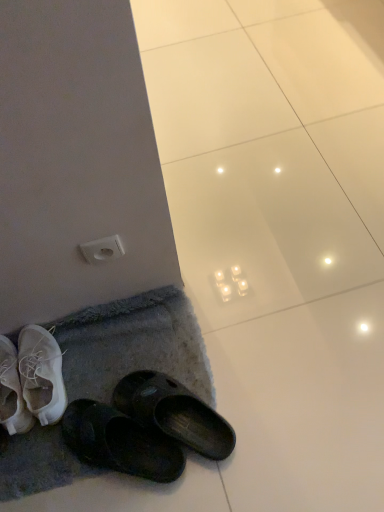
What is the approximate height of gray textured bath mat at lower left?

gray textured bath mat at lower left is 4.61 centimeters tall.

The width and height of the screenshot is (384, 512). In order to click on gray textured bath mat at lower left in this screenshot , I will do `click(134, 345)`.

Image resolution: width=384 pixels, height=512 pixels. What do you see at coordinates (134, 345) in the screenshot?
I see `gray textured bath mat at lower left` at bounding box center [134, 345].

Locate an element on the screen. white plastic outlet at upper left is located at coordinates (102, 249).

What do you see at coordinates (102, 249) in the screenshot? Image resolution: width=384 pixels, height=512 pixels. I see `white plastic outlet at upper left` at bounding box center [102, 249].

Identify the location of gray textured bath mat at lower left. The height and width of the screenshot is (512, 384). (134, 345).

Between gray textured bath mat at lower left and white plastic outlet at upper left, which one appears on the left side from the viewer's perspective?

Positioned to the left is gray textured bath mat at lower left.

Looking at this image, is the depth of gray textured bath mat at lower left greater than that of white plastic outlet at upper left?

Yes, gray textured bath mat at lower left is further from the viewer.

Does point (134, 318) come in front of point (107, 254)?

No, (134, 318) is further to viewer.

From the image's perspective, between gray textured bath mat at lower left and white plastic outlet at upper left, which one is located above?

white plastic outlet at upper left appears higher in the image.

From a real-world perspective, is gray textured bath mat at lower left above or below white plastic outlet at upper left?

From a real-world perspective, gray textured bath mat at lower left is physically below white plastic outlet at upper left.

In terms of width, does gray textured bath mat at lower left look wider or thinner when compared to white plastic outlet at upper left?

gray textured bath mat at lower left is wider than white plastic outlet at upper left.

In the scene shown: Does gray textured bath mat at lower left have a greater height compared to white plastic outlet at upper left?

No, gray textured bath mat at lower left is not taller than white plastic outlet at upper left.

Between gray textured bath mat at lower left and white plastic outlet at upper left, which one has smaller size?

Smaller between the two is white plastic outlet at upper left.

Is gray textured bath mat at lower left spatially inside white plastic outlet at upper left, or outside of it?

gray textured bath mat at lower left is outside white plastic outlet at upper left.

Consider the image. Would you consider gray textured bath mat at lower left to be distant from white plastic outlet at upper left?

No, gray textured bath mat at lower left is in close proximity to white plastic outlet at upper left.

Is white plastic outlet at upper left at the back of gray textured bath mat at lower left?

gray textured bath mat at lower left does not have its back to white plastic outlet at upper left.

Identify the location of bath mat on the left of white plastic outlet at upper left. (134, 345).

Would you say white plastic outlet at upper left is to the left or to the right of gray textured bath mat at lower left in the picture?

white plastic outlet at upper left is positioned on gray textured bath mat at lower left's right side.

Is white plastic outlet at upper left positioned in front of gray textured bath mat at lower left?

Yes, it is.

Considering the positions of points (84, 247) and (56, 464), is point (84, 247) farther from camera compared to point (56, 464)?

That is False.

From the image's perspective, who appears lower, white plastic outlet at upper left or gray textured bath mat at lower left?

gray textured bath mat at lower left.

From a real-world perspective, which object stands above the other?

white plastic outlet at upper left is physically above.

Considering the sizes of objects white plastic outlet at upper left and gray textured bath mat at lower left in the image provided, who is wider, white plastic outlet at upper left or gray textured bath mat at lower left?

Wider between the two is gray textured bath mat at lower left.

Considering the sizes of objects white plastic outlet at upper left and gray textured bath mat at lower left in the image provided, who is taller, white plastic outlet at upper left or gray textured bath mat at lower left?

white plastic outlet at upper left is taller.

Between white plastic outlet at upper left and gray textured bath mat at lower left, which one has larger size?

With larger size is gray textured bath mat at lower left.

Is gray textured bath mat at lower left inside white plastic outlet at upper left?

No, white plastic outlet at upper left does not contain gray textured bath mat at lower left.

Is white plastic outlet at upper left not near gray textured bath mat at lower left?

No.

Is white plastic outlet at upper left facing towards gray textured bath mat at lower left?

No.

How different are the orientations of white plastic outlet at upper left and gray textured bath mat at lower left in degrees?

white plastic outlet at upper left and gray textured bath mat at lower left are facing 0.0104 degrees away from each other.

The width and height of the screenshot is (384, 512). I want to click on bath mat located on the left of white plastic outlet at upper left, so click(x=134, y=345).

Locate an element on the screen. bath mat behind the white plastic outlet at upper left is located at coordinates (134, 345).

You are a GUI agent. You are given a task and a screenshot of the screen. Output one action in this format:
    pyautogui.click(x=<x>, y=<y>)
    Task: Click on the bath mat that is on the left side of white plastic outlet at upper left
    This screenshot has width=384, height=512.
    Given the screenshot: What is the action you would take?
    pyautogui.click(x=134, y=345)